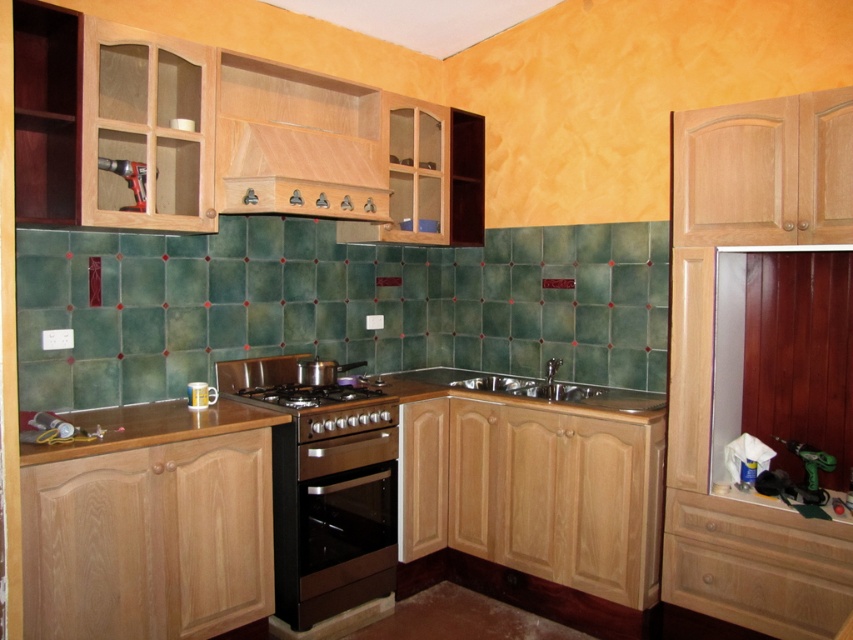
Does black stainless steel oven at center appear on the left side of white glossy mug at lower left?

No, black stainless steel oven at center is not to the left of white glossy mug at lower left.

The image size is (853, 640). What are the coordinates of `black stainless steel oven at center` in the screenshot? It's located at (334, 513).

Locate an element on the screen. The width and height of the screenshot is (853, 640). black stainless steel oven at center is located at coordinates (334, 513).

Find the location of a particular element. The image size is (853, 640). black stainless steel oven at center is located at coordinates (334, 513).

Which is below, satin nickel sink at center or black stainless steel gas stove at center?

black stainless steel gas stove at center

This screenshot has width=853, height=640. Identify the location of satin nickel sink at center. [x=532, y=385].

The height and width of the screenshot is (640, 853). I want to click on satin nickel sink at center, so click(x=532, y=385).

Who is positioned more to the left, brown wood countertop at lower left or satin nickel sink at center?

brown wood countertop at lower left is more to the left.

Does brown wood countertop at lower left have a greater width compared to satin nickel sink at center?

Yes.

What do you see at coordinates (149, 428) in the screenshot?
I see `brown wood countertop at lower left` at bounding box center [149, 428].

Locate an element on the screen. brown wood countertop at lower left is located at coordinates (149, 428).